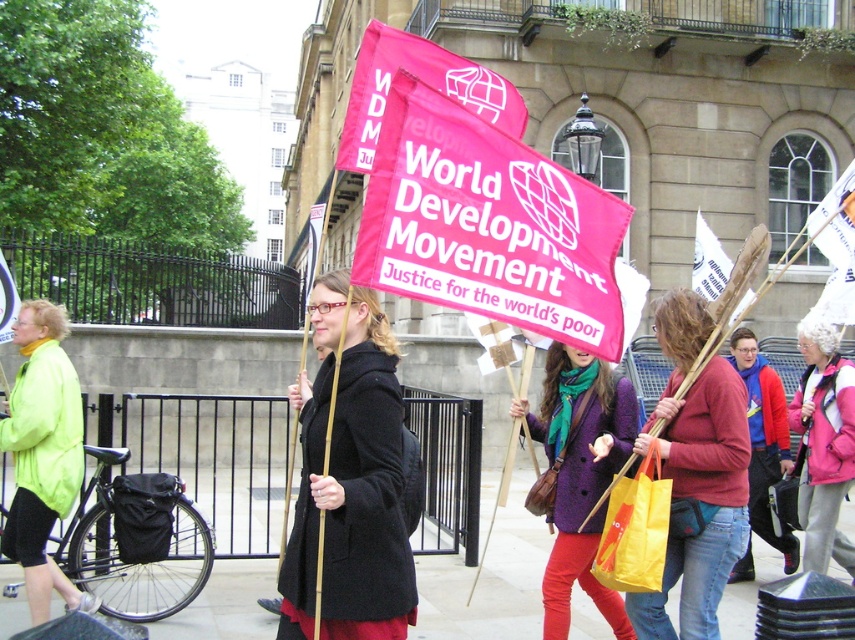
You are a photographer trying to capture a group photo of the matte black coat at center and the purple wool coat at center. The camera you are using has a maximum focus range of 5 feet. Will you be able to fit both individuals in the frame without moving closer?

The matte black coat at center and purple wool coat at center are 5.71 feet apart from each other. Since the distance between them exceeds the camera maximum focus range of 5 feet, you cannot fit both individuals in the frame without moving closer.